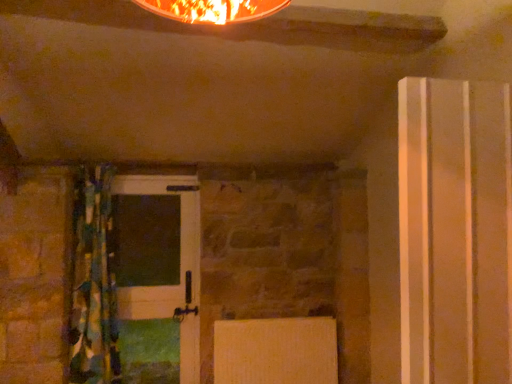
Question: Is transparent plastic door at right, the 1th door when ordered from front to back, positioned behind textured multicolored curtain at left?

Choices:
 (A) no
 (B) yes

Answer: (A)

Question: Is transparent plastic door at right, the 1th door when ordered from front to back, oriented towards textured multicolored curtain at left?

Choices:
 (A) no
 (B) yes

Answer: (A)

Question: Considering the relative sizes of transparent plastic door at right, which is the second door in left-to-right order, and textured multicolored curtain at left in the image provided, is transparent plastic door at right, which is the second door in left-to-right order, bigger than textured multicolored curtain at left?

Choices:
 (A) yes
 (B) no

Answer: (B)

Question: Does transparent plastic door at right, which is counted as the 2th door, starting from the back, come in front of textured multicolored curtain at left?

Choices:
 (A) yes
 (B) no

Answer: (A)

Question: Is there a large distance between transparent plastic door at right, the 1th door when ordered from front to back, and textured multicolored curtain at left?

Choices:
 (A) yes
 (B) no

Answer: (A)

Question: In terms of size, does transparent plastic door at right, which is the second door in left-to-right order, appear bigger or smaller than textured multicolored curtain at left?

Choices:
 (A) big
 (B) small

Answer: (B)

Question: Is transparent plastic door at right, which is counted as the 2th door, starting from the back, situated inside textured multicolored curtain at left or outside?

Choices:
 (A) inside
 (B) outside

Answer: (B)

Question: From the image's perspective, relative to textured multicolored curtain at left, is transparent plastic door at right, the 1th door when ordered from front to back, above or below?

Choices:
 (A) below
 (B) above

Answer: (B)

Question: Considering their positions, is transparent plastic door at right, which is counted as the 2th door, starting from the back, located in front of or behind textured multicolored curtain at left?

Choices:
 (A) front
 (B) behind

Answer: (A)

Question: Would you say textured multicolored curtain at left is inside or outside transparent plastic door at right, which is the second door in left-to-right order?

Choices:
 (A) inside
 (B) outside

Answer: (B)

Question: Would you say textured multicolored curtain at left is to the left or to the right of transparent plastic door at right, which is counted as the 2th door, starting from the back, in the picture?

Choices:
 (A) right
 (B) left

Answer: (B)

Question: Is point (76, 188) positioned closer to the camera than point (450, 135)?

Choices:
 (A) closer
 (B) farther

Answer: (B)

Question: Looking at their shapes, would you say textured multicolored curtain at left is wider or thinner than transparent plastic door at right, which is counted as the 2th door, starting from the back?

Choices:
 (A) wide
 (B) thin

Answer: (A)

Question: From the image's perspective, is transparent plastic door at right, which is counted as the first door, starting from the right, positioned above or below white glossy door at center, the 1th door from the back?

Choices:
 (A) above
 (B) below

Answer: (A)

Question: Choose the correct answer: Is transparent plastic door at right, the 1th door when ordered from front to back, inside white glossy door at center, the 1th door in the left-to-right sequence, or outside it?

Choices:
 (A) outside
 (B) inside

Answer: (A)